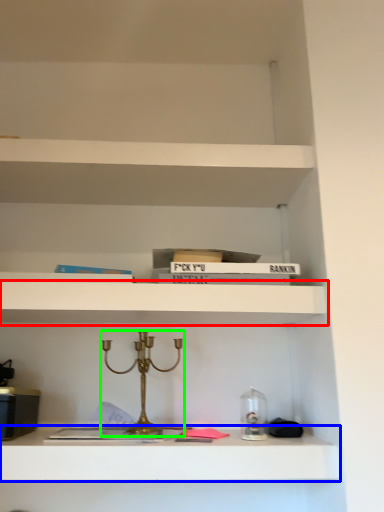
Question: Which object is positioned farthest from shelf (highlighted by a red box)? Select from shelf (highlighted by a blue box) and candle holder (highlighted by a green box).

Choices:
 (A) shelf
 (B) candle holder

Answer: (A)